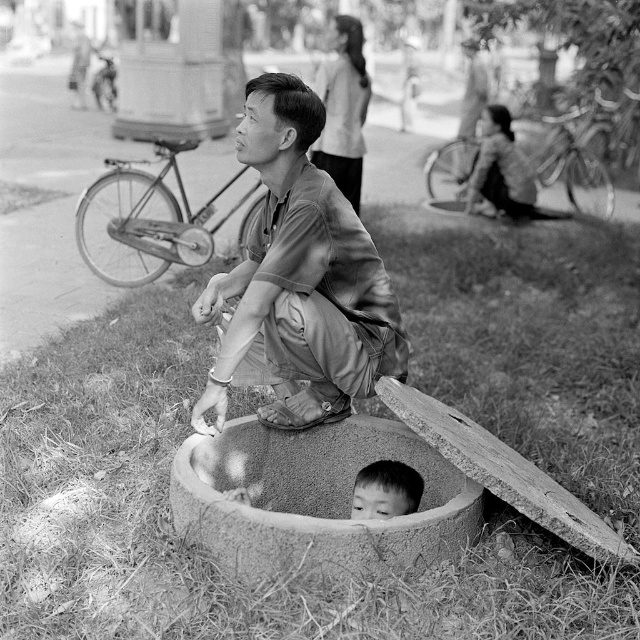
Question: Estimate the real-world distances between objects in this image. Which object is farther from the smooth concrete basin at lower center?

Choices:
 (A) smooth skin child at center
 (B) matte brown shirt at center

Answer: (B)

Question: Is matte brown shirt at center wider than smooth concrete basin at lower center?

Choices:
 (A) yes
 (B) no

Answer: (B)

Question: Which object is positioned closest to the matte brown shirt at center?

Choices:
 (A) smooth concrete basin at lower center
 (B) smooth skin child at center

Answer: (A)

Question: Based on their relative distances, which object is nearer to the matte brown shirt at center?

Choices:
 (A) smooth concrete basin at lower center
 (B) smooth skin child at center

Answer: (A)

Question: Can you confirm if smooth concrete basin at lower center is positioned to the right of smooth skin child at center?

Choices:
 (A) yes
 (B) no

Answer: (B)

Question: Where is matte brown shirt at center located in relation to smooth skin child at center in the image?

Choices:
 (A) below
 (B) above

Answer: (B)